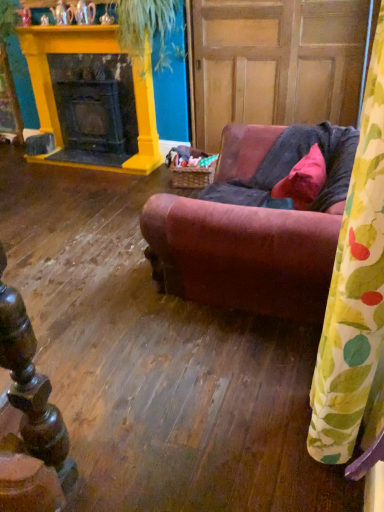
Image resolution: width=384 pixels, height=512 pixels. Find the location of `vacant space behind yellow-green leaf-patterned curtain at right`. vacant space behind yellow-green leaf-patterned curtain at right is located at coordinates (284, 376).